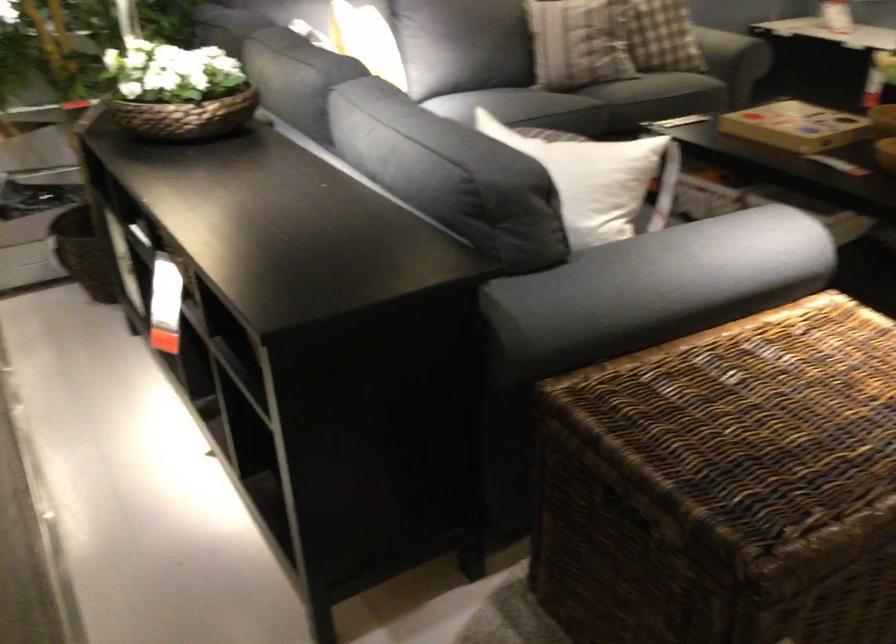
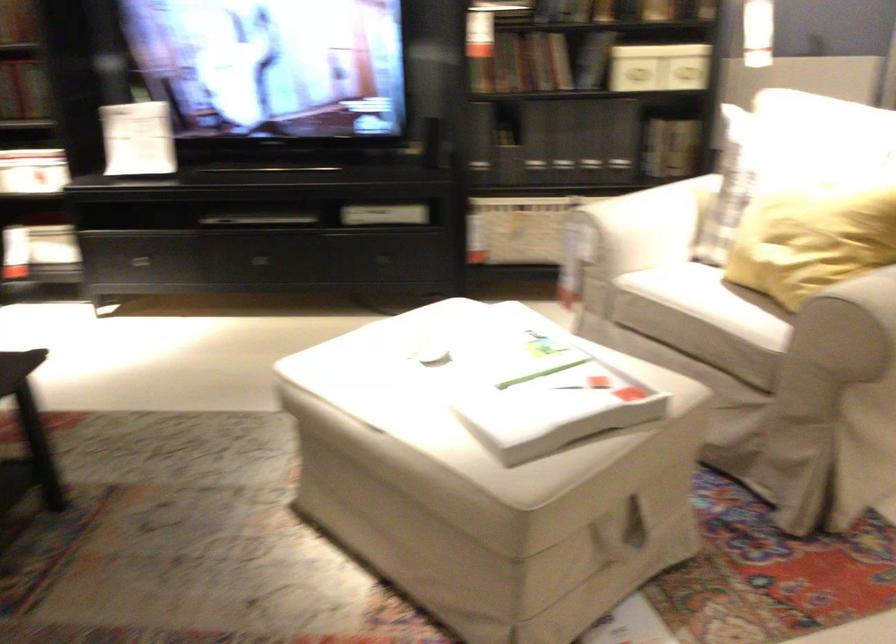
Question: The camera is either moving clockwise (left) or counter-clockwise (right) around the object. The first image is from the beginning of the video and the second image is from the end. Is the camera moving left or right when shooting the video?

Choices:
 (A) Left
 (B) Right

Answer: (A)